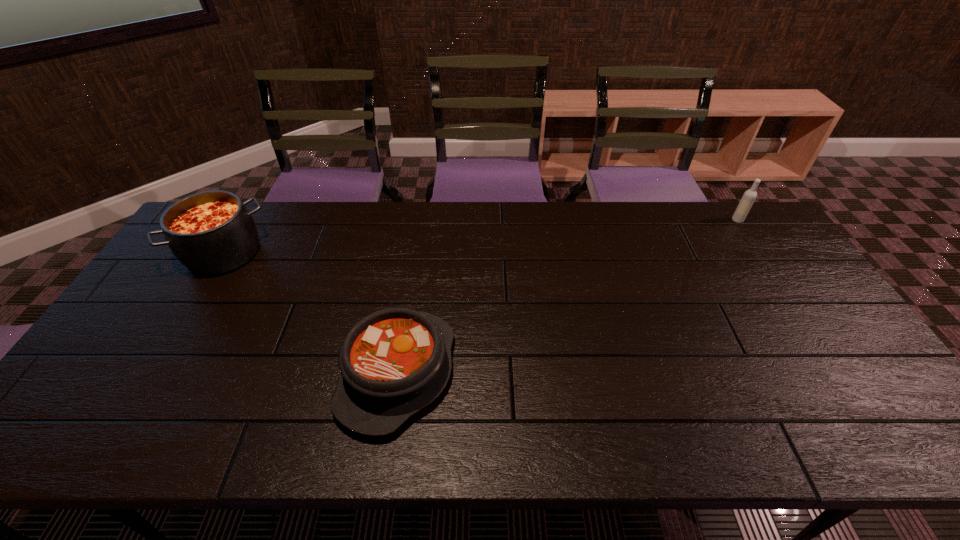
You are a GUI agent. You are given a task and a screenshot of the screen. Output one action in this format:
    pyautogui.click(x=<x>, y=<y>)
    Task: Click on the casserole that is positioned at the far edge
    Image resolution: width=960 pixels, height=540 pixels.
    Given the screenshot: What is the action you would take?
    pyautogui.click(x=212, y=232)

The height and width of the screenshot is (540, 960). I want to click on object that is at the near edge, so click(x=394, y=362).

At what (x,y) coordinates should I click in order to perform the action: click on object present at the left edge. Please return your answer as a coordinate pair (x, y). The width and height of the screenshot is (960, 540). Looking at the image, I should click on (212, 232).

What are the coordinates of `object located at the right edge` in the screenshot? It's located at (746, 202).

Locate an element on the screen. The width and height of the screenshot is (960, 540). object that is at the far left corner is located at coordinates (212, 232).

The width and height of the screenshot is (960, 540). What are the coordinates of `object present at the far right corner` in the screenshot? It's located at (746, 202).

Find the location of `blank space at the far edge of the desktop`. blank space at the far edge of the desktop is located at coordinates (261, 209).

In the image, there is a desktop. Where is `vacant space at the near edge`? vacant space at the near edge is located at coordinates (654, 447).

At what (x,y) coordinates should I click in order to perform the action: click on free space at the left edge of the desktop. Please return your answer as a coordinate pair (x, y). Looking at the image, I should click on (75, 389).

Identify the location of vacant region at the near left corner of the desktop. The width and height of the screenshot is (960, 540). (110, 415).